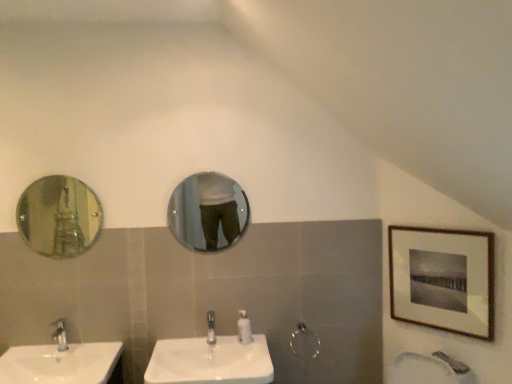
Question: Is shiny silver mirror at left, arranged as the first mirror when viewed from the left, situated inside wooden-framed print at upper right or outside?

Choices:
 (A) outside
 (B) inside

Answer: (A)

Question: Considering the positions of shiny silver mirror at left, placed as the second mirror when sorted from back to front, and wooden-framed print at upper right in the image, is shiny silver mirror at left, placed as the second mirror when sorted from back to front, bigger or smaller than wooden-framed print at upper right?

Choices:
 (A) small
 (B) big

Answer: (A)

Question: Estimate the real-world distances between objects in this image. Which object is farther from the white glossy soap dispenser at center?

Choices:
 (A) wooden-framed print at upper right
 (B) silver metallic shower at center
 (C) matte glass mirror at center, marked as the 2th mirror in a left-to-right arrangement
 (D) silver metallic faucet at lower left, the 2th tap when ordered from right to left
 (E) white glossy sink at center, the second sink positioned from the left

Answer: (A)

Question: Which object is the closest to the white glossy sink at lower left, which ranks as the first sink in left-to-right order?

Choices:
 (A) white glossy sink at center, which is the first sink from right to left
 (B) shiny silver mirror at left, the 2th mirror viewed from the right
 (C) wooden-framed print at upper right
 (D) silver metallic shower at center
 (E) matte glass mirror at center, marked as the 2th mirror in a left-to-right arrangement

Answer: (A)